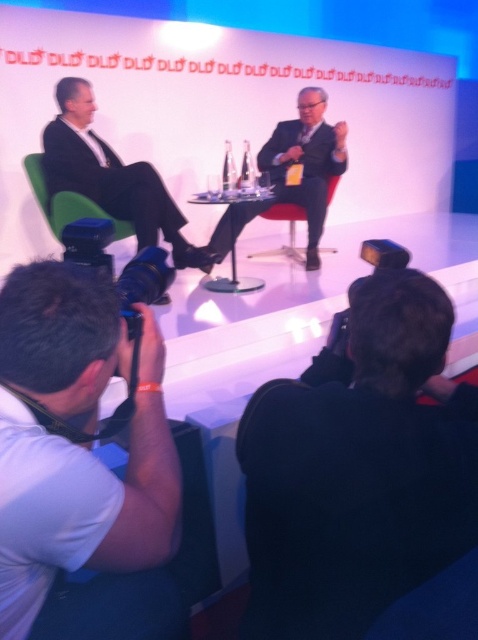
Question: Based on their relative distances, which object is farther from the matte black suit at left?

Choices:
 (A) green fabric chair at left
 (B) matte black suit at center
 (C) red leather chair at center

Answer: (C)

Question: Is blue plastic camera at lower left thinner than green fabric chair at left?

Choices:
 (A) no
 (B) yes

Answer: (B)

Question: Does matte black suit at center appear on the left side of green fabric chair at left?

Choices:
 (A) yes
 (B) no

Answer: (B)

Question: Based on their relative distances, which object is farther from the matte black suit at center?

Choices:
 (A) blue plastic camera at lower left
 (B) red leather chair at center
 (C) matte black suit at left

Answer: (A)

Question: Considering the real-world distances, which object is closest to the blue plastic camera at lower left?

Choices:
 (A) green fabric chair at left
 (B) matte black suit at center
 (C) matte black suit at left

Answer: (A)

Question: Can you confirm if matte black suit at left is smaller than matte black suit at center?

Choices:
 (A) yes
 (B) no

Answer: (A)